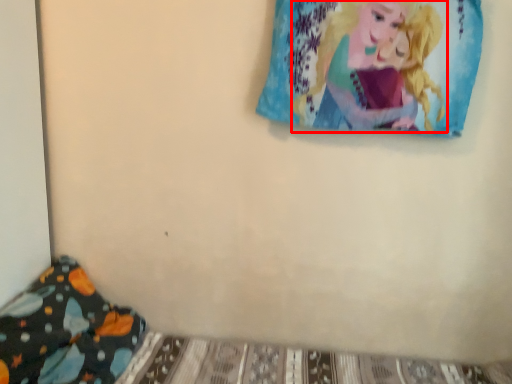
Question: From the image's perspective, what is the correct spatial relationship of person (annotated by the red box) in relation to pillow?

Choices:
 (A) below
 (B) above

Answer: (B)